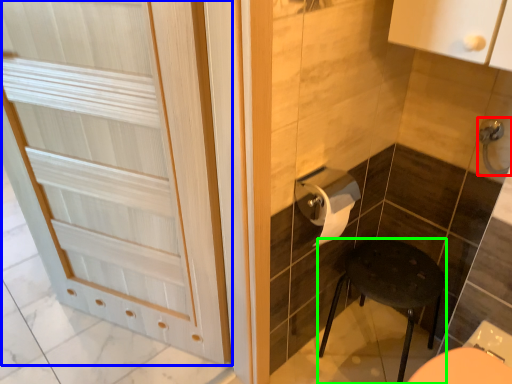
Question: Which object is the farthest from door handle (highlighted by a red box)? Choose among these: door (highlighted by a blue box) or furniture (highlighted by a green box).

Choices:
 (A) door
 (B) furniture

Answer: (A)